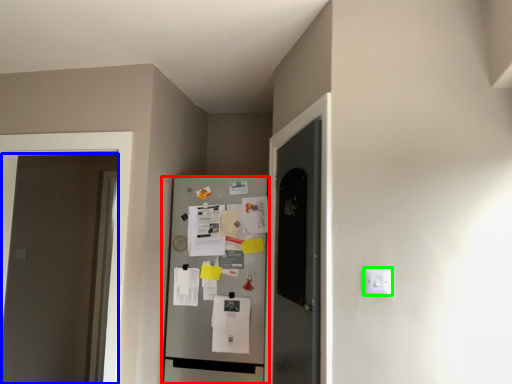
Question: Based on their relative distances, which object is farther from refrigerator (highlighted by a red box)? Choose from door (highlighted by a blue box) and electric outlet (highlighted by a green box).

Choices:
 (A) door
 (B) electric outlet

Answer: (A)